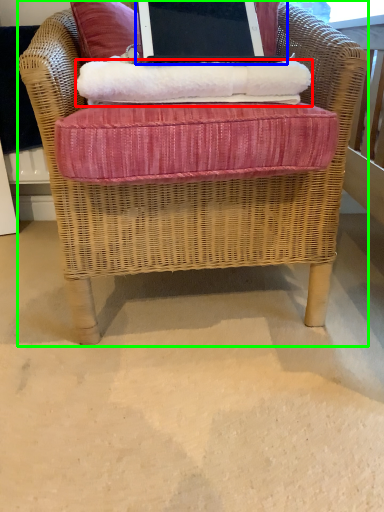
Question: Which object is the closest to the material (highlighted by a red box)? Choose among these: laptop (highlighted by a blue box) or chair (highlighted by a green box).

Choices:
 (A) laptop
 (B) chair

Answer: (B)